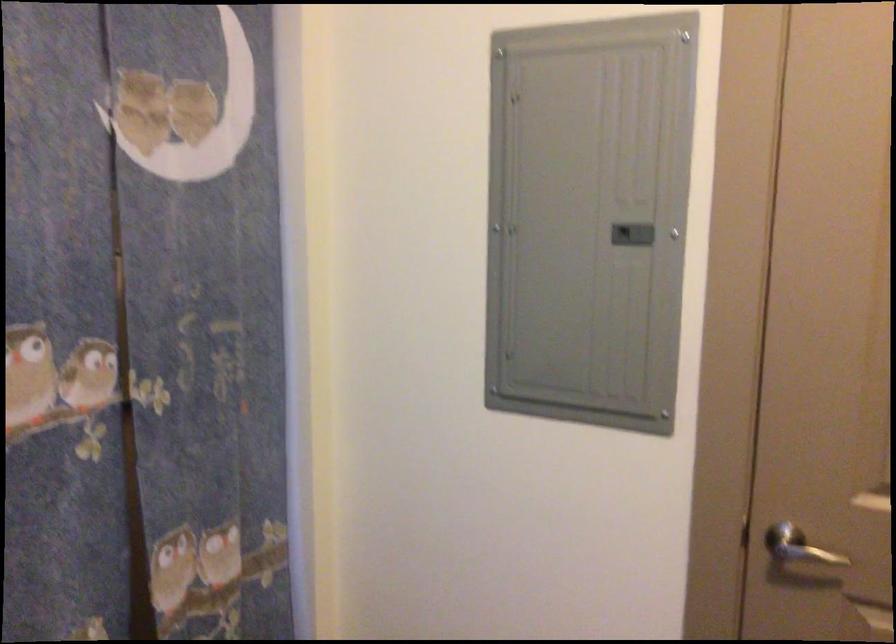
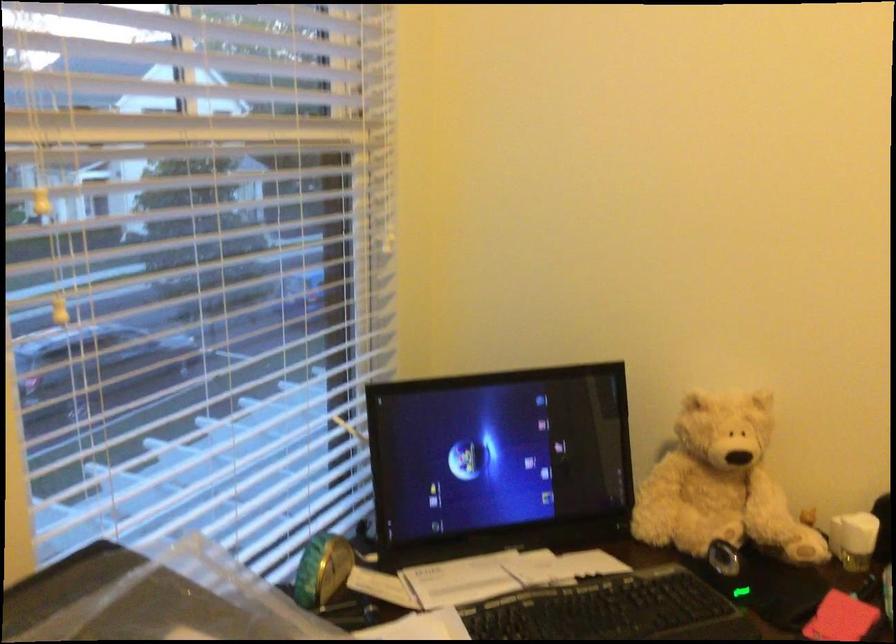
Question: How did the camera likely rotate?

Choices:
 (A) Left
 (B) Right
 (C) Up
 (D) Down

Answer: (A)